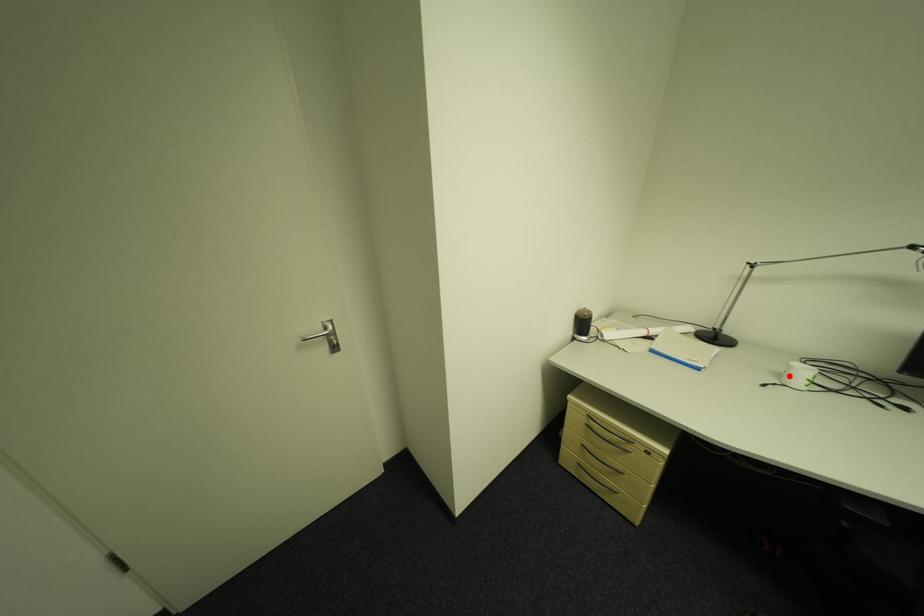
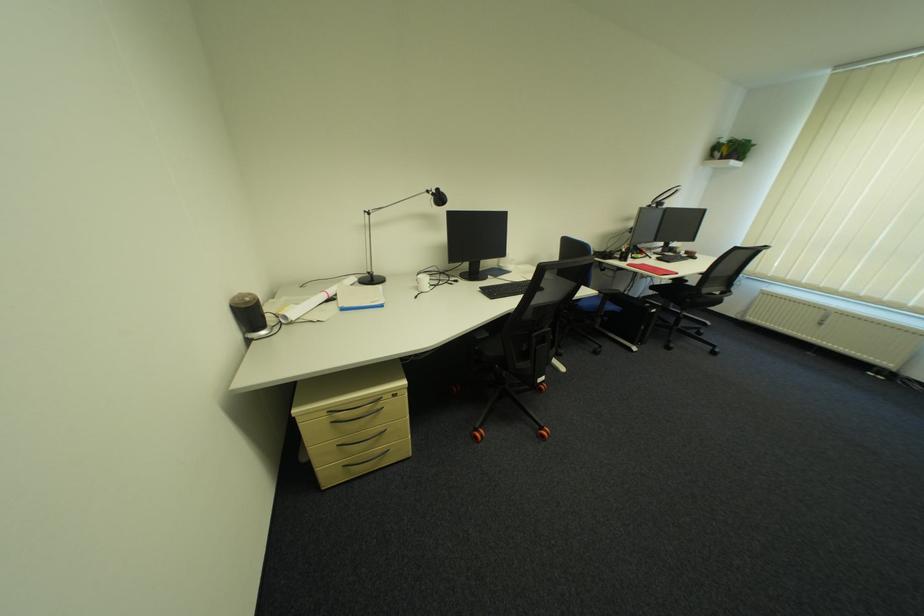
In the second image, find the point that corresponds to the highlighted location in the first image.

(427, 288)